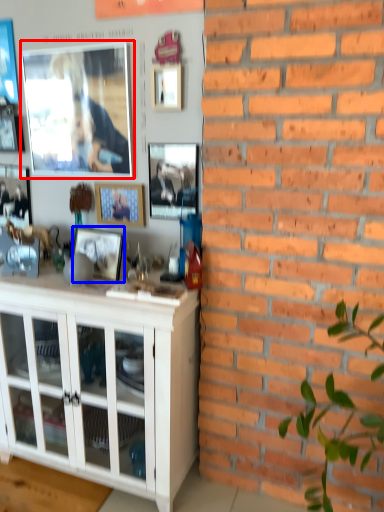
Question: Among these objects, which one is nearest to the camera, picture frame (highlighted by a red box) or picture frame (highlighted by a blue box)?

Choices:
 (A) picture frame
 (B) picture frame

Answer: (B)